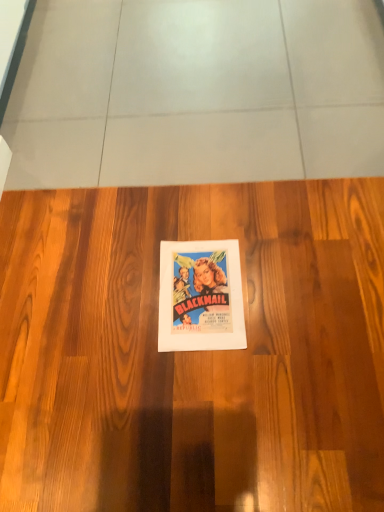
What are the coordinates of `vacant region to the left of vibrant paper poster at center` in the screenshot? It's located at (117, 303).